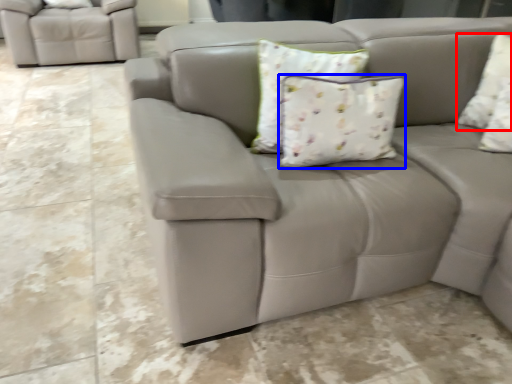
Question: Which object is closer to the camera taking this photo, pillow (highlighted by a red box) or pillow (highlighted by a blue box)?

Choices:
 (A) pillow
 (B) pillow

Answer: (B)